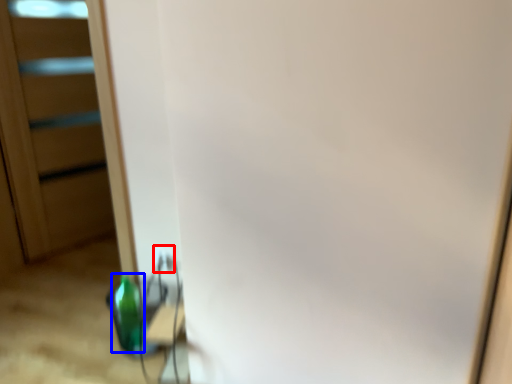
Question: Which point is further to the camera, electric outlet (highlighted by a red box) or bottle (highlighted by a blue box)?

Choices:
 (A) electric outlet
 (B) bottle

Answer: (A)